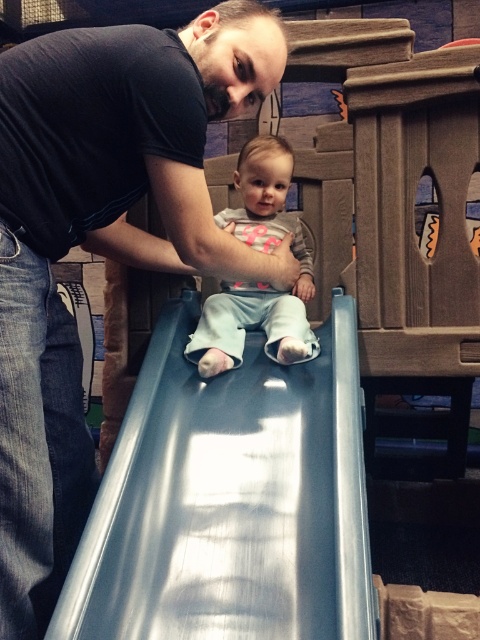
Question: Which object is closer to the camera taking this photo?

Choices:
 (A) metallic smooth slide at center
 (B) light blue fabric pants at center

Answer: (A)

Question: Is metallic smooth slide at center wider than light blue fabric pants at center?

Choices:
 (A) no
 (B) yes

Answer: (B)

Question: Which point is farther to the camera?

Choices:
 (A) (220, 220)
 (B) (147, 264)

Answer: (A)

Question: Which of these objects is positioned closest to the light blue fabric pants at center?

Choices:
 (A) metallic smooth slide at center
 (B) black matte shirt at upper left

Answer: (A)

Question: Can you confirm if metallic smooth slide at center is smaller than light blue fabric pants at center?

Choices:
 (A) no
 (B) yes

Answer: (A)

Question: Is black matte shirt at upper left closer to camera compared to metallic smooth slide at center?

Choices:
 (A) yes
 (B) no

Answer: (B)